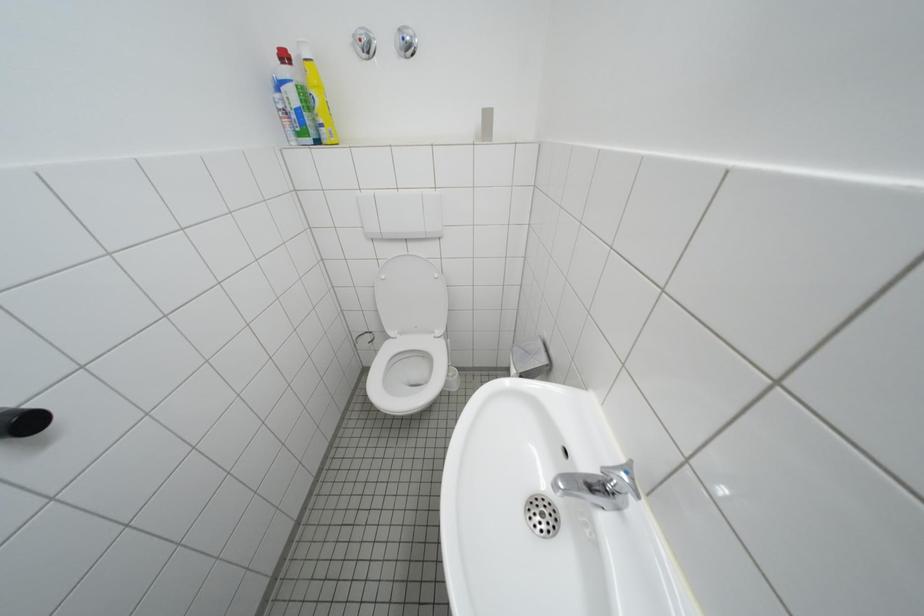
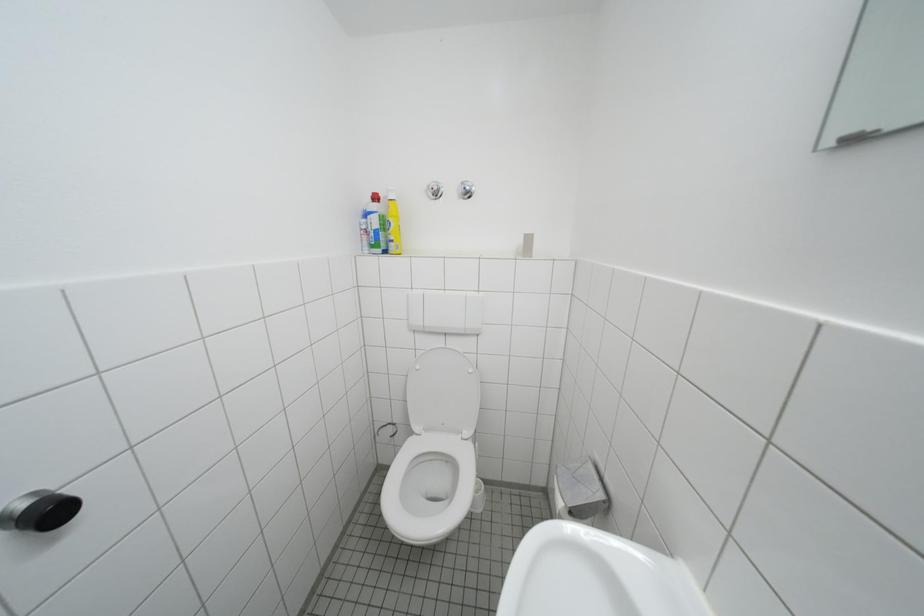
Question: Based on the continuous images, in which direction is the camera rotating? Reply with the corresponding letter.

Choices:
 (A) Left
 (B) Right
 (C) Up
 (D) Down

Answer: (C)